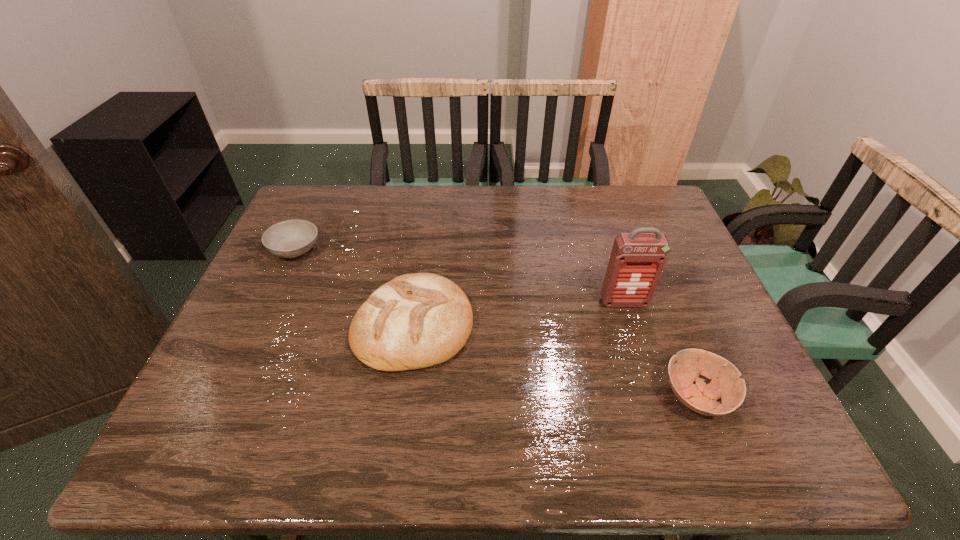
Locate an element on the screen. object that is at the near edge is located at coordinates (726, 384).

You are a GUI agent. You are given a task and a screenshot of the screen. Output one action in this format:
    pyautogui.click(x=<x>, y=<y>)
    Task: Click on the object that is at the left edge
    
    Given the screenshot: What is the action you would take?
    pyautogui.click(x=293, y=238)

At what (x,y) coordinates should I click in order to perform the action: click on object present at the right edge. Please return your answer as a coordinate pair (x, y). The image size is (960, 540). Looking at the image, I should click on (726, 384).

Where is `object present at the near right corner`? object present at the near right corner is located at coordinates (726, 384).

Find the location of `vacant space at the far edge of the desktop`. vacant space at the far edge of the desktop is located at coordinates (493, 199).

You are a GUI agent. You are given a task and a screenshot of the screen. Output one action in this format:
    pyautogui.click(x=<x>, y=<y>)
    Task: Click on the free space at the near edge of the desktop
    This screenshot has width=960, height=540.
    Given the screenshot: What is the action you would take?
    pyautogui.click(x=318, y=430)

At what (x,y) coordinates should I click in order to perform the action: click on blank space at the left edge of the desktop. Please return your answer as a coordinate pair (x, y). The height and width of the screenshot is (540, 960). Looking at the image, I should click on (262, 292).

Locate an element on the screen. This screenshot has height=540, width=960. free location at the right edge is located at coordinates (754, 373).

This screenshot has height=540, width=960. In the image, there is a desktop. Find the location of `free space at the far left corner`. free space at the far left corner is located at coordinates (331, 197).

Locate an element on the screen. This screenshot has width=960, height=540. free space at the far right corner of the desktop is located at coordinates (615, 192).